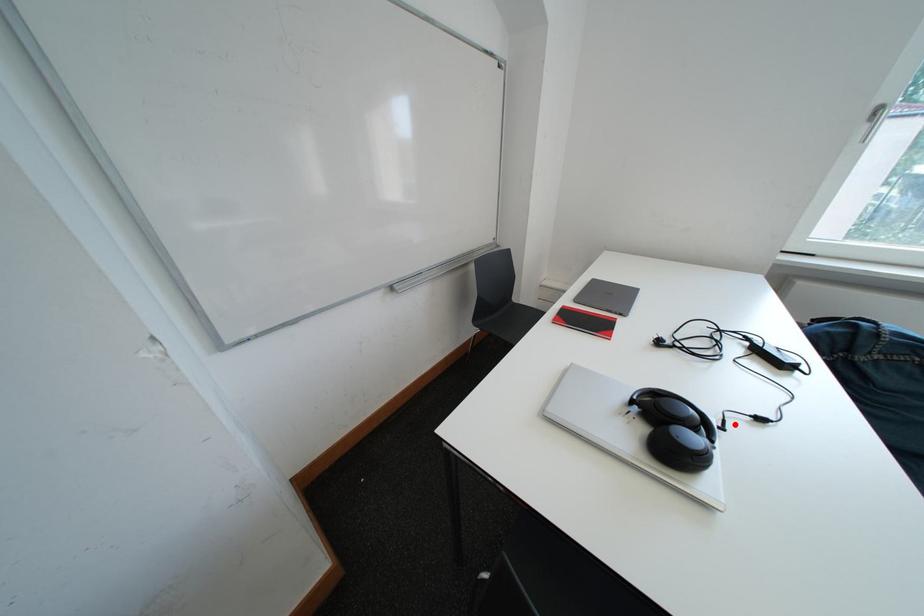
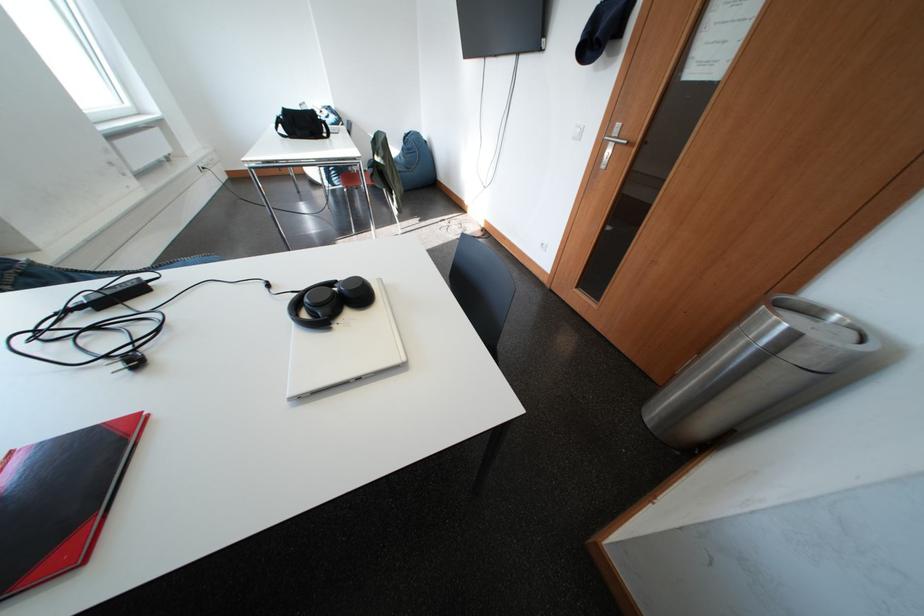
In the second image, find the point that corresponds to the highlighted location in the first image.

(304, 294)